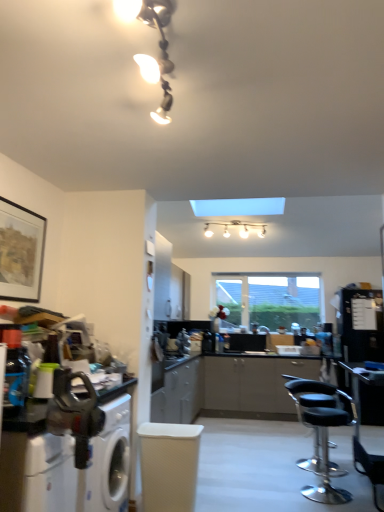
Question: Is the position of matte black picture frame at upper left more distant than that of transparent glass window at center?

Choices:
 (A) no
 (B) yes

Answer: (A)

Question: Does matte black picture frame at upper left have a larger size compared to transparent glass window at center?

Choices:
 (A) yes
 (B) no

Answer: (B)

Question: From the image's perspective, would you say matte black picture frame at upper left is positioned over transparent glass window at center?

Choices:
 (A) yes
 (B) no

Answer: (A)

Question: Can you confirm if matte black picture frame at upper left is shorter than transparent glass window at center?

Choices:
 (A) no
 (B) yes

Answer: (B)

Question: Is matte black picture frame at upper left wider than transparent glass window at center?

Choices:
 (A) no
 (B) yes

Answer: (A)

Question: Considering the relative sizes of matte black picture frame at upper left and transparent glass window at center in the image provided, is matte black picture frame at upper left taller than transparent glass window at center?

Choices:
 (A) yes
 (B) no

Answer: (B)

Question: From a real-world perspective, is metallic silver countertop at lower left physically above metallic glass light fixture at upper center?

Choices:
 (A) no
 (B) yes

Answer: (A)

Question: From the image's perspective, would you say metallic silver countertop at lower left is shown under metallic glass light fixture at upper center?

Choices:
 (A) no
 (B) yes

Answer: (B)

Question: Are metallic silver countertop at lower left and metallic glass light fixture at upper center making contact?

Choices:
 (A) yes
 (B) no

Answer: (B)

Question: Considering the relative sizes of metallic silver countertop at lower left and metallic glass light fixture at upper center in the image provided, is metallic silver countertop at lower left wider than metallic glass light fixture at upper center?

Choices:
 (A) yes
 (B) no

Answer: (B)

Question: Is metallic silver countertop at lower left positioned in front of metallic glass light fixture at upper center?

Choices:
 (A) no
 (B) yes

Answer: (A)

Question: From the image's perspective, is metallic silver countertop at lower left on metallic glass light fixture at upper center?

Choices:
 (A) yes
 (B) no

Answer: (B)

Question: Is white textured swivel chair at center far from metallic glass light fixture at upper center?

Choices:
 (A) yes
 (B) no

Answer: (A)